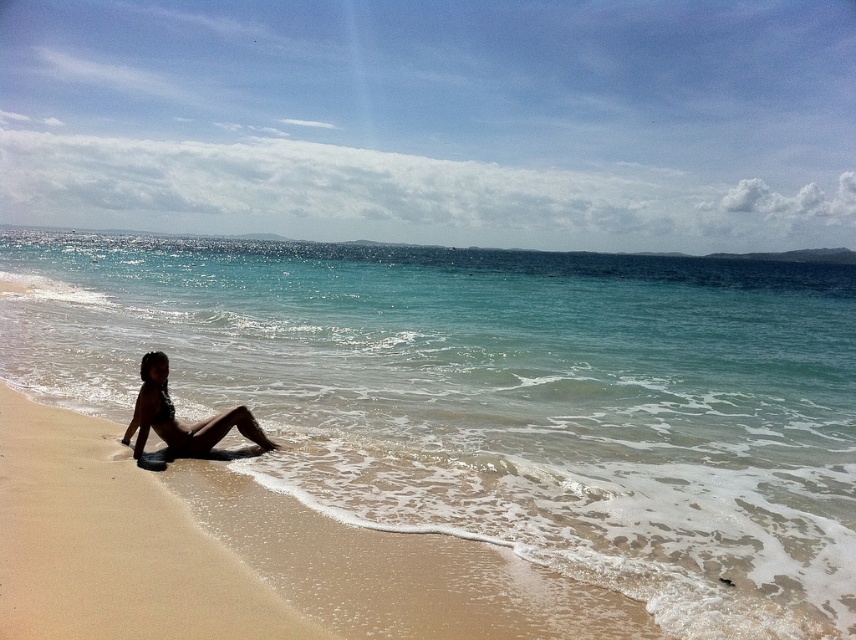
How much distance is there between clear blue water at center and beige sand at lower left?

47.87 meters

Does clear blue water at center appear over beige sand at lower left?

Indeed, clear blue water at center is positioned over beige sand at lower left.

Is point (825, 602) positioned before point (45, 449)?

That is True.

Locate an element on the screen. This screenshot has height=640, width=856. clear blue water at center is located at coordinates (498, 400).

Which is more to the left, beige sand at lower left or matte black bikini at lower left?

From the viewer's perspective, matte black bikini at lower left appears more on the left side.

Is point (382, 618) farther from viewer compared to point (146, 435)?

No, (382, 618) is in front of (146, 435).

At what (x,y) coordinates should I click in order to perform the action: click on beige sand at lower left. Please return your answer as a coordinate pair (x, y). The height and width of the screenshot is (640, 856). Looking at the image, I should click on (241, 556).

Describe the element at coordinates (498, 400) in the screenshot. I see `clear blue water at center` at that location.

Can you confirm if clear blue water at center is bigger than matte black bikini at lower left?

Correct, clear blue water at center is larger in size than matte black bikini at lower left.

What do you see at coordinates (498, 400) in the screenshot? I see `clear blue water at center` at bounding box center [498, 400].

This screenshot has width=856, height=640. Identify the location of clear blue water at center. (498, 400).